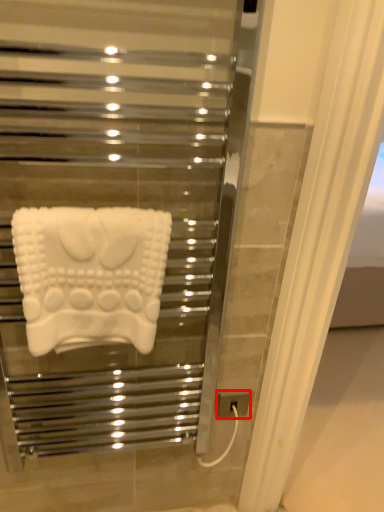
Question: From the image's perspective, considering the relative positions of electric outlet (annotated by the red box) and towel in the image provided, where is electric outlet (annotated by the red box) located with respect to the staircase?

Choices:
 (A) below
 (B) above

Answer: (A)